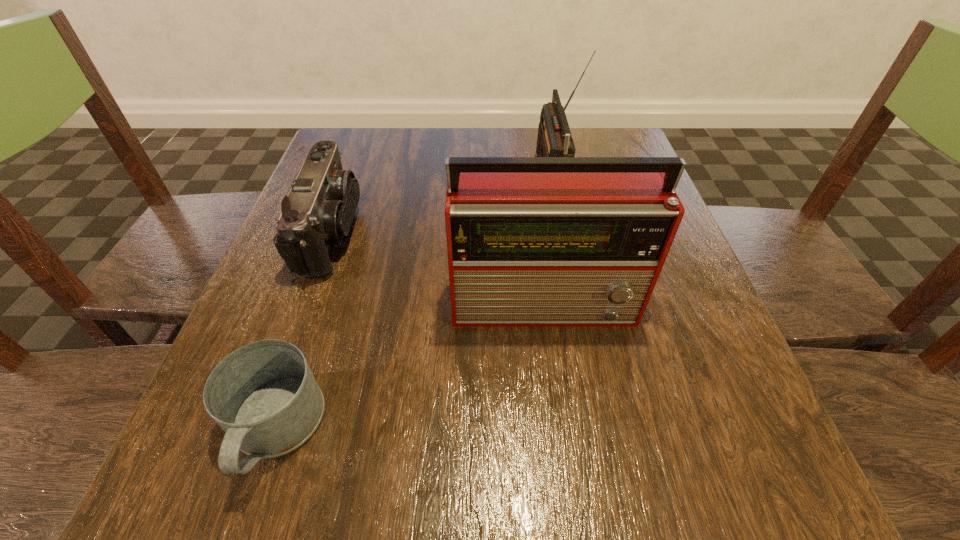
Where is `the farther radio receiver`? This screenshot has height=540, width=960. the farther radio receiver is located at coordinates (554, 139).

The image size is (960, 540). Identify the location of the nearer radio receiver. (532, 241).

The image size is (960, 540). Identify the location of camcorder. (318, 212).

Where is `the shortest object`? the shortest object is located at coordinates (264, 396).

I want to click on the nearest object, so click(x=264, y=396).

The width and height of the screenshot is (960, 540). I want to click on vacant region located 0.240m on the front-facing side of the farther radio receiver, so click(433, 173).

What are the coordinates of `free spot located 0.290m on the front-facing side of the farther radio receiver` in the screenshot? It's located at (411, 173).

Where is `free point located on the front-facing side of the farther radio receiver`? The width and height of the screenshot is (960, 540). free point located on the front-facing side of the farther radio receiver is located at coordinates (472, 173).

Locate an element on the screen. The height and width of the screenshot is (540, 960). free location located on the front-facing side of the nearer radio receiver is located at coordinates (560, 389).

Where is `blank space located on the front-facing side of the third tallest object`? Image resolution: width=960 pixels, height=540 pixels. blank space located on the front-facing side of the third tallest object is located at coordinates (559, 232).